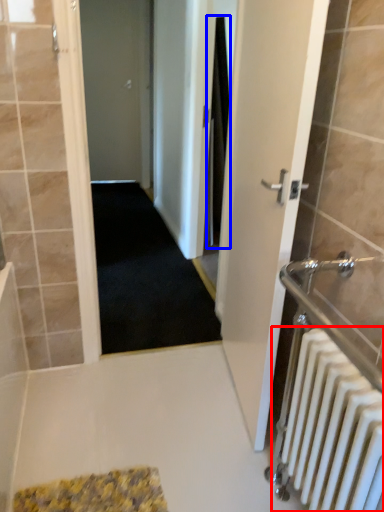
Question: Which object appears closest to the camera in this image, radiator (highlighted by a red box) or shower curtain (highlighted by a blue box)?

Choices:
 (A) radiator
 (B) shower curtain

Answer: (A)